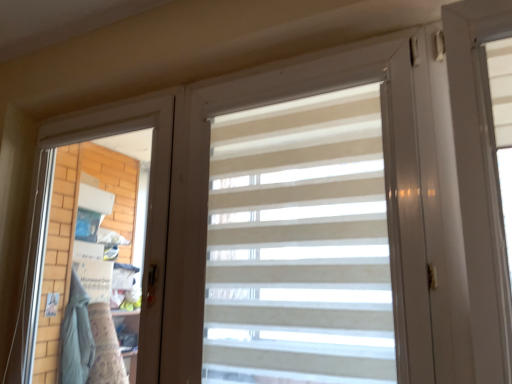
Find the location of a particular element. The image size is (512, 384). white matte screen door at left is located at coordinates (99, 234).

The image size is (512, 384). What do you see at coordinates (99, 234) in the screenshot? I see `white matte screen door at left` at bounding box center [99, 234].

Measure the distance between point (238, 377) and camera.

Point (238, 377) is 1.31 meters away from camera.

Image resolution: width=512 pixels, height=384 pixels. I want to click on beige striped curtain at center, so click(x=298, y=245).

What do you see at coordinates (298, 245) in the screenshot?
I see `beige striped curtain at center` at bounding box center [298, 245].

Where is `white matte screen door at left`? This screenshot has width=512, height=384. white matte screen door at left is located at coordinates (99, 234).

Is white matte screen door at left to the right of beige striped curtain at center from the viewer's perspective?

In fact, white matte screen door at left is to the left of beige striped curtain at center.

From the picture: Is white matte screen door at left positioned behind beige striped curtain at center?

Yes, white matte screen door at left is further from the viewer.

Which is less distant, [149,322] or [350,170]?

The point [350,170] is more forward.

From the image's perspective, which is above, white matte screen door at left or beige striped curtain at center?

beige striped curtain at center is shown above in the image.

From a real-world perspective, is white matte screen door at left positioned above or below beige striped curtain at center?

white matte screen door at left is situated lower than beige striped curtain at center in the real world.

Which of these two, white matte screen door at left or beige striped curtain at center, is wider?

With larger width is beige striped curtain at center.

Can you confirm if white matte screen door at left is taller than beige striped curtain at center?

Correct, white matte screen door at left is much taller as beige striped curtain at center.

Does white matte screen door at left have a smaller size compared to beige striped curtain at center?

Incorrect, white matte screen door at left is not smaller in size than beige striped curtain at center.

Do you think white matte screen door at left is within beige striped curtain at center, or outside of it?

white matte screen door at left lies outside beige striped curtain at center.

Is white matte screen door at left placed right next to beige striped curtain at center?

No, white matte screen door at left is not with beige striped curtain at center.

Is white matte screen door at left oriented away from beige striped curtain at center?

white matte screen door at left does not have its back to beige striped curtain at center.

How different are the orientations of white matte screen door at left and beige striped curtain at center in degrees?

The angular difference between white matte screen door at left and beige striped curtain at center is 0.00026 degrees.

Image resolution: width=512 pixels, height=384 pixels. Find the location of `curtain in front of the white matte screen door at left`. curtain in front of the white matte screen door at left is located at coordinates (298, 245).

Is beige striped curtain at center at the left side of white matte screen door at left?

In fact, beige striped curtain at center is to the right of white matte screen door at left.

Which object is more forward, beige striped curtain at center or white matte screen door at left?

beige striped curtain at center is closer to the camera.

Does point (327, 314) come behind point (114, 185)?

No.

From the image's perspective, does beige striped curtain at center appear lower than white matte screen door at left?

Actually, beige striped curtain at center appears above white matte screen door at left in the image.

From a real-world perspective, is beige striped curtain at center on top of white matte screen door at left?

Yes, from a real-world perspective, beige striped curtain at center is over white matte screen door at left

Is beige striped curtain at center thinner than white matte screen door at left?

No, beige striped curtain at center is not thinner than white matte screen door at left.

Who is shorter, beige striped curtain at center or white matte screen door at left?

A: beige striped curtain at center.

Considering the sizes of beige striped curtain at center and white matte screen door at left in the image, is beige striped curtain at center bigger or smaller than white matte screen door at left?

Clearly, beige striped curtain at center is smaller in size than white matte screen door at left.

Is beige striped curtain at center outside of white matte screen door at left?

Absolutely, beige striped curtain at center is external to white matte screen door at left.

Are beige striped curtain at center and white matte screen door at left far apart?

They are positioned close to each other.

Is beige striped curtain at center oriented away from white matte screen door at left?

No, beige striped curtain at center is not facing away from white matte screen door at left.

Where is `curtain on the right of the white matte screen door at left`? This screenshot has height=384, width=512. curtain on the right of the white matte screen door at left is located at coordinates (298, 245).

Locate an element on the screen. This screenshot has height=384, width=512. curtain on the right of white matte screen door at left is located at coordinates (298, 245).

I want to click on screen door that appears below the beige striped curtain at center (from a real-world perspective), so point(99,234).